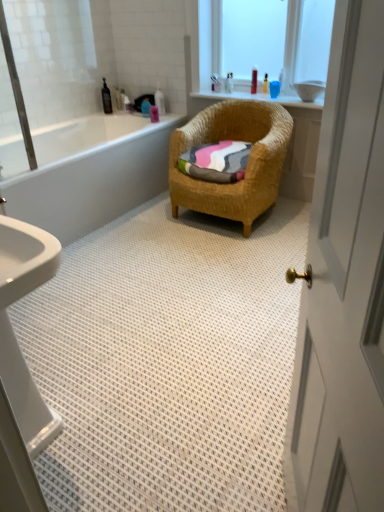
At what (x,y) coordinates should I click in order to perform the action: click on vacant area that is in front of black plastic bottle at upper left, positioned as the seventh toiletry in right-to-left order. Please return your answer as a coordinate pair (x, y). Looking at the image, I should click on (99, 117).